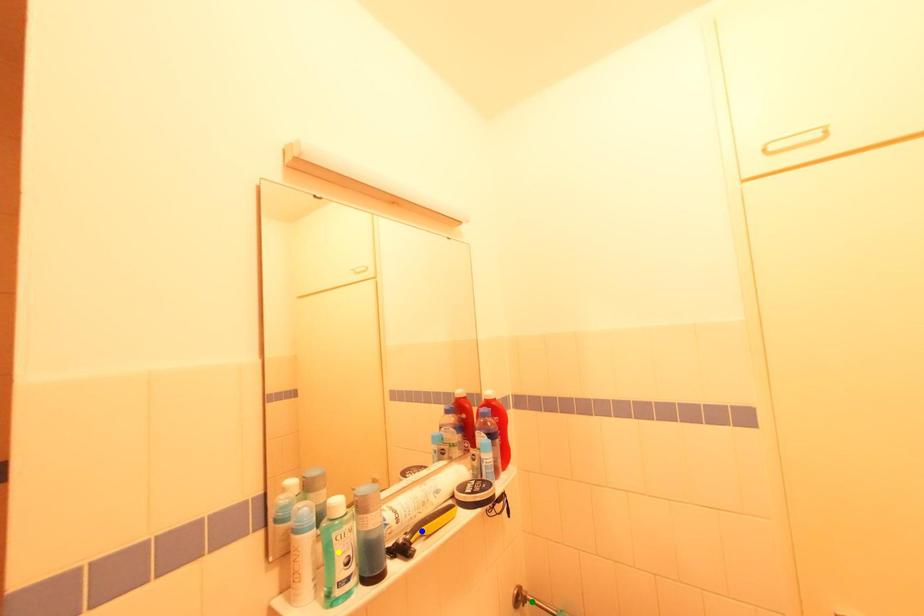
Order these from nearest to farthest:
- green point
- blue point
- yellow point

1. yellow point
2. blue point
3. green point